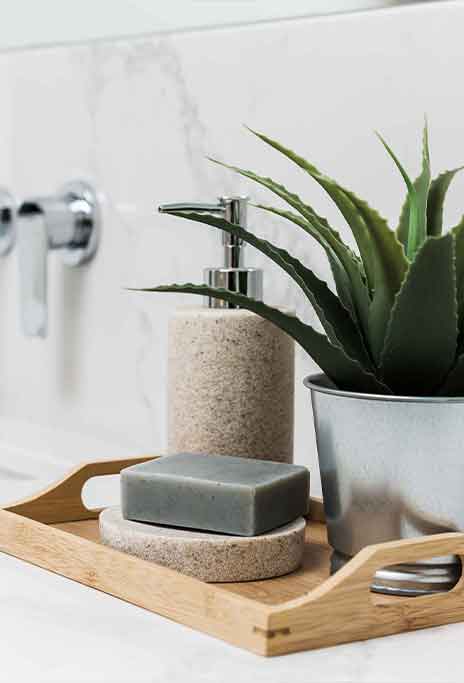
This screenshot has height=683, width=464. I want to click on bar of grayish green soap, so point(227,505).